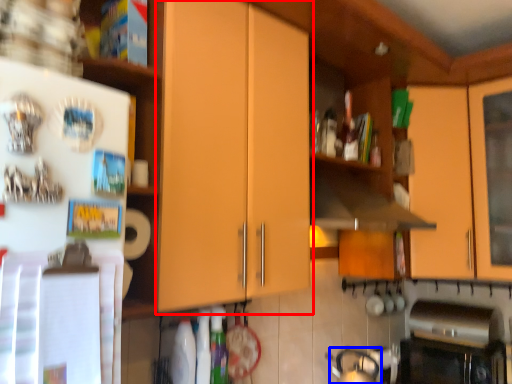
Question: Which of the following is the closest to the observer, cabinetry (highlighted by a red box) or tea pot (highlighted by a blue box)?

Choices:
 (A) cabinetry
 (B) tea pot

Answer: (A)